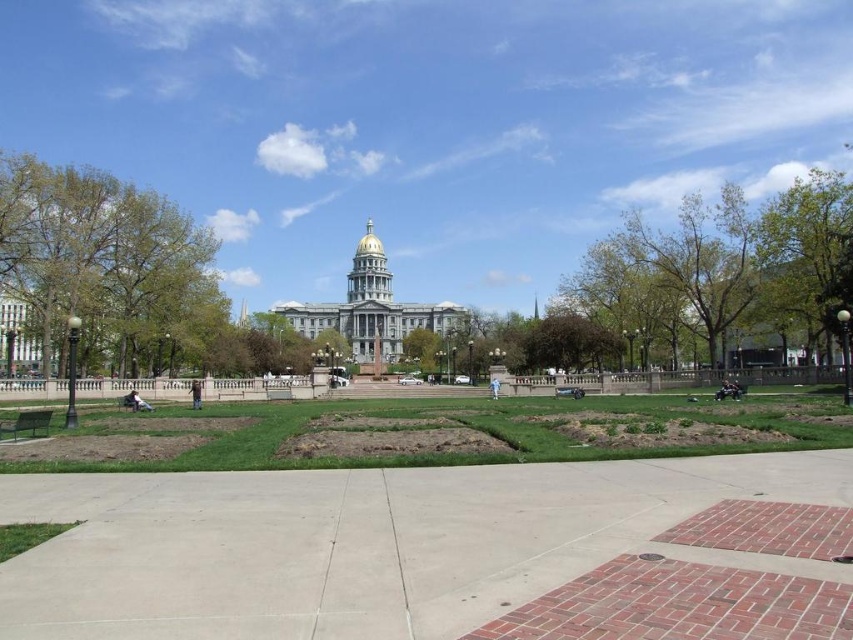
You are a gardener planning to water the concrete at center and the green leafy tree at left. Since you can only water one area today, which one should you prioritize based on their current positions?

The green leafy tree at left should be prioritized because the concrete at center is positioned under it, meaning the tree might require more immediate care to ensure its health and prevent damage to the surrounding area.